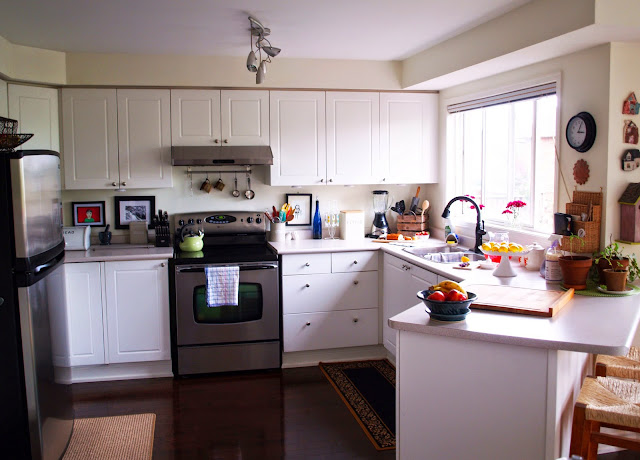
Locate an element on the screen. The height and width of the screenshot is (460, 640). clock is located at coordinates (568, 126).